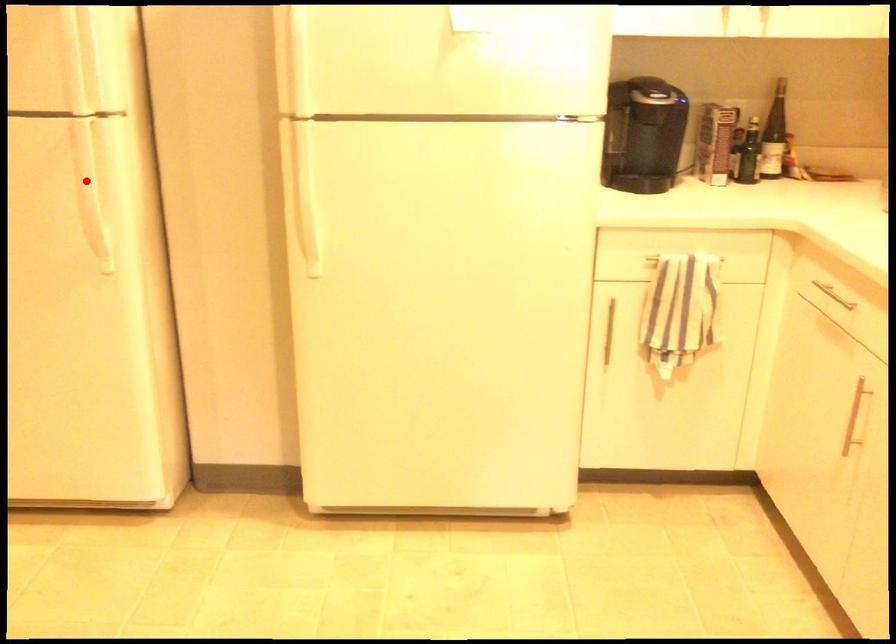
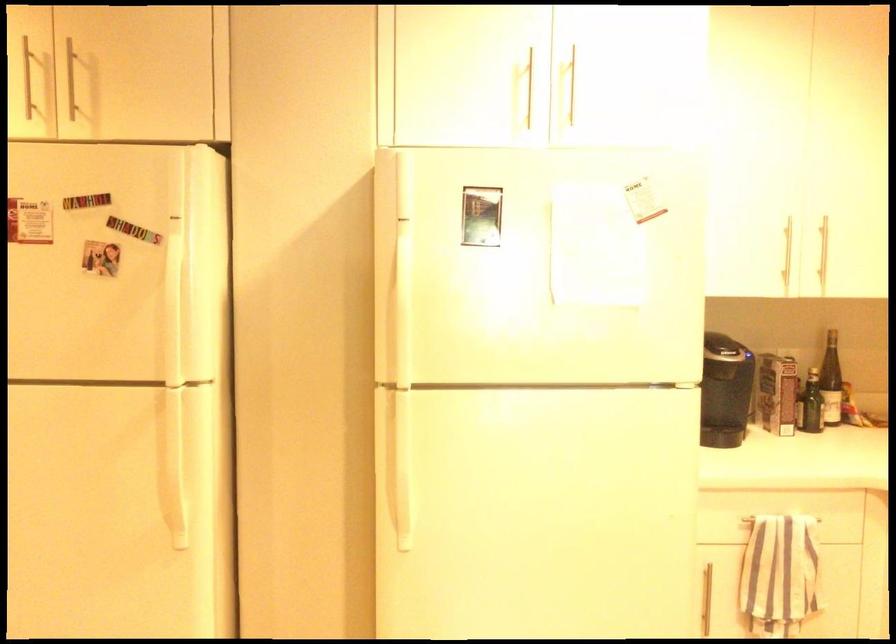
In the second image, find the point that corresponds to the highlighted location in the first image.

(170, 453)